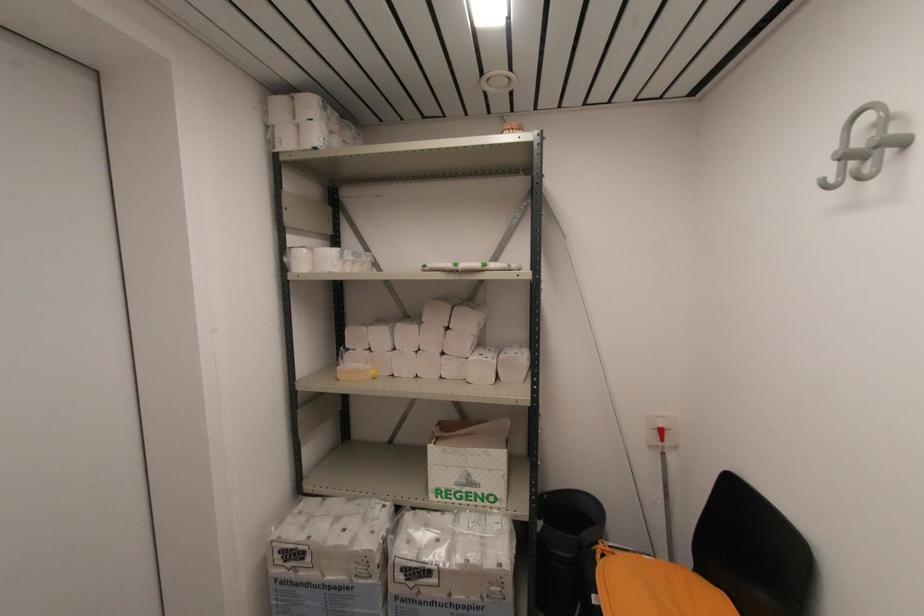
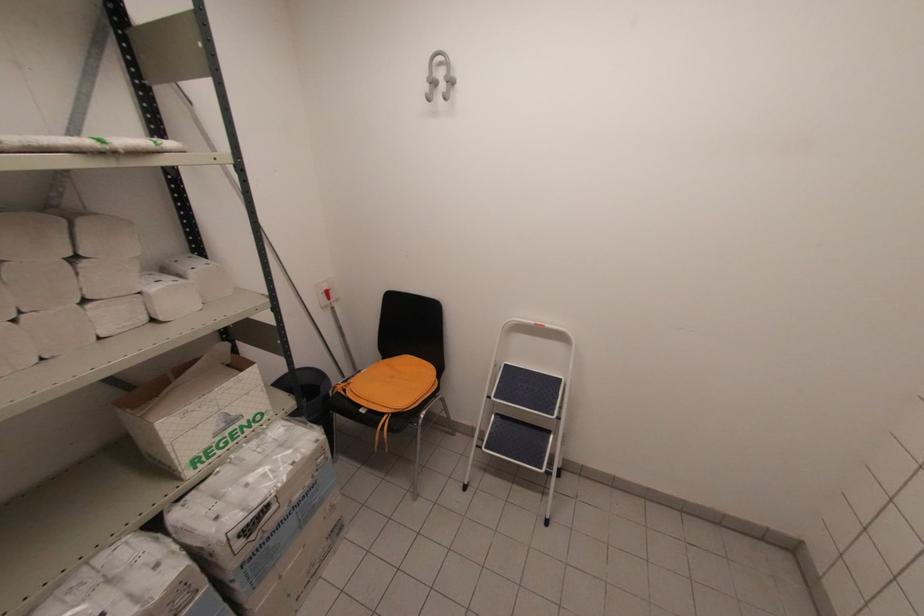
In the second image, find the point that corresponds to point (451, 326) in the first image.

(81, 254)